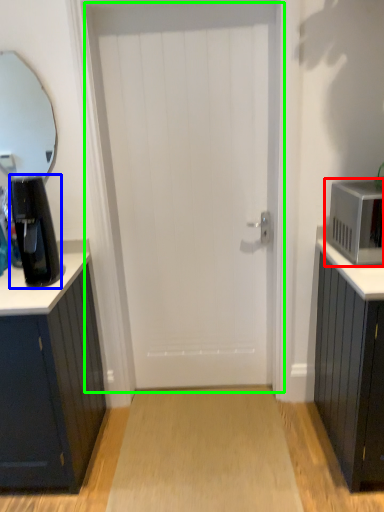
Question: Which object is the farthest from microwave oven (highlighted by a red box)? Choose among these: coffee maker (highlighted by a blue box) or door (highlighted by a green box).

Choices:
 (A) coffee maker
 (B) door

Answer: (A)